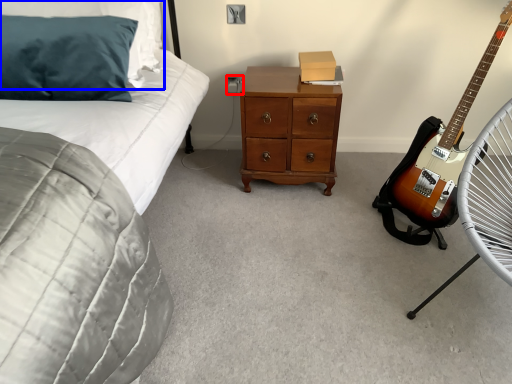
Question: Which of the following is the closest to the observer, electric outlet (highlighted by a red box) or pillow (highlighted by a blue box)?

Choices:
 (A) electric outlet
 (B) pillow

Answer: (B)